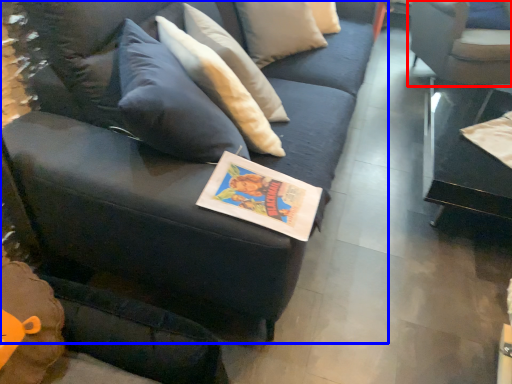
Question: Which object appears farthest to the camera in this image, chair (highlighted by a red box) or studio couch (highlighted by a blue box)?

Choices:
 (A) chair
 (B) studio couch

Answer: (A)